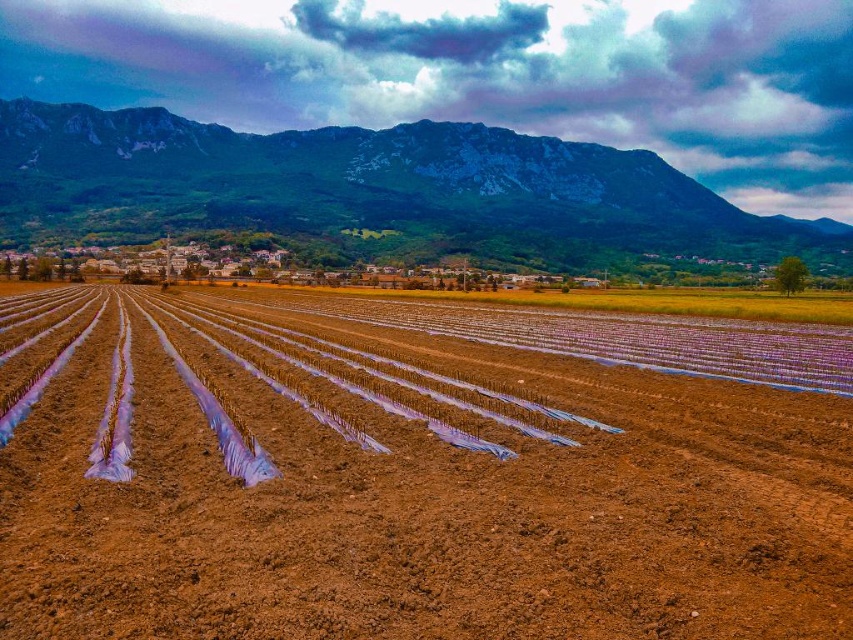
Question: Does brown soil at center have a larger size compared to green textured mountain at upper center?

Choices:
 (A) no
 (B) yes

Answer: (A)

Question: Is brown soil at center further to camera compared to green textured mountain at upper center?

Choices:
 (A) yes
 (B) no

Answer: (B)

Question: Can you confirm if brown soil at center is positioned to the left of green textured mountain at upper center?

Choices:
 (A) no
 (B) yes

Answer: (B)

Question: Which point appears closest to the camera in this image?

Choices:
 (A) (550, 241)
 (B) (670, 362)

Answer: (B)

Question: Which object appears closest to the camera in this image?

Choices:
 (A) brown soil at center
 (B) green textured mountain at upper center

Answer: (A)